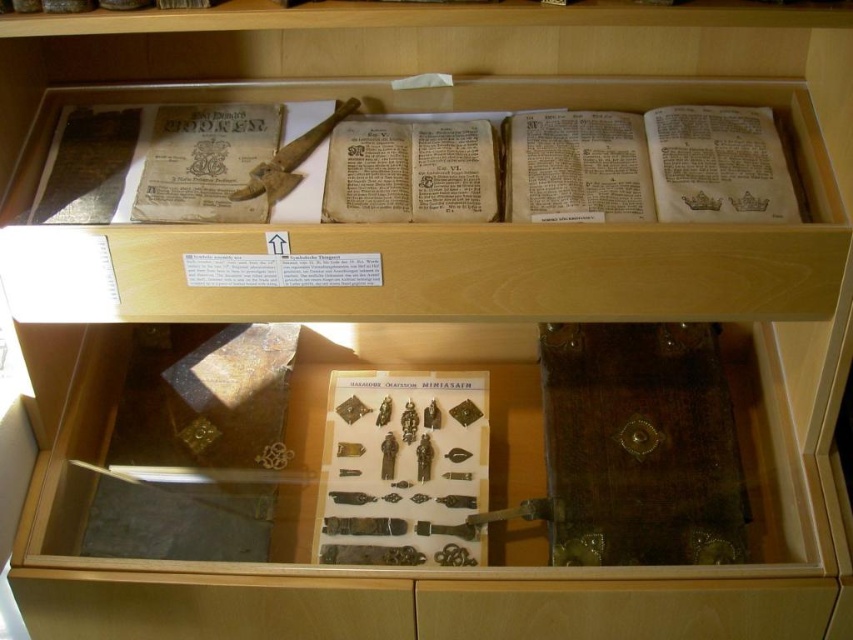
Question: Which of the following is the closest to the observer?

Choices:
 (A) (206, 195)
 (B) (280, 164)

Answer: (A)

Question: Which of the following is the farthest from the observer?

Choices:
 (A) yellowed paper book at upper left
 (B) wooden staff at center

Answer: (B)

Question: Is yellowed paper book at upper left above wooden staff at center?

Choices:
 (A) yes
 (B) no

Answer: (B)

Question: In this image, where is yellowed paper book at upper left located relative to wooden staff at center?

Choices:
 (A) left
 (B) right

Answer: (A)

Question: Is yellowed paper book at upper left positioned before wooden staff at center?

Choices:
 (A) yes
 (B) no

Answer: (A)

Question: Which of the following is the closest to the observer?

Choices:
 (A) wooden staff at center
 (B) yellowed paper book at upper left

Answer: (B)